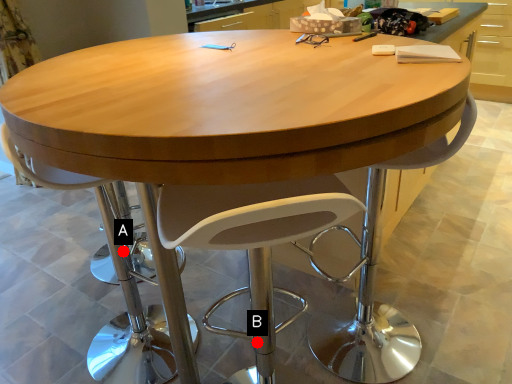
Question: Two points are circled on the image, labeled by A and B beside each circle. Which point appears farthest from the camera in this image?

Choices:
 (A) A is further
 (B) B is further

Answer: (A)